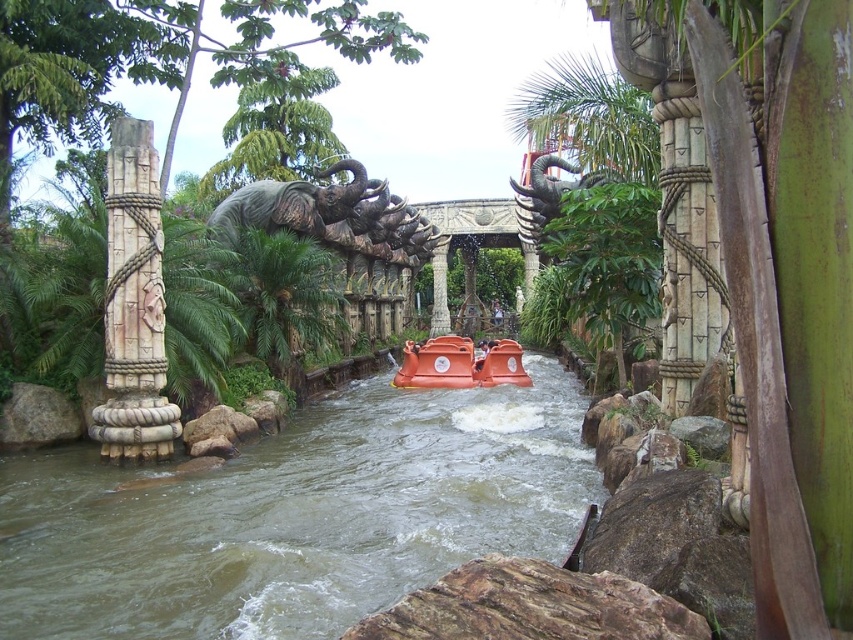
You are navigating a brown rubber boat at center on a waterway flanked by rocky banks and decorative columns. The boat must pass through a narrow passage. Given that the boat is at coordinates point 0.808, 0.348, can you determine if it is positioned correctly to navigate through the passage?

The brown rubber boat at center is positioned at point (296, 516), which is the correct coordinates to navigate through the narrow passage between the rocky banks and decorative columns.

You are a visitor standing at the entrance of the amusement park ride and see the carved stone column at left and the stone statue at center. Which object is closer to you?

The carved stone column at left is closer to you because it is in front of the stone statue at center.

You are a guest at the amusement park and want to take a photo of the brown rubber boat at center and the stone statue at center together in the frame. Which object should you position closer to the camera to ensure both are fully visible in the photo?

To ensure both the brown rubber boat at center and the stone statue at center are fully visible in the photo, you should position the brown rubber boat at center closer to the camera since it is shorter than the stone statue at center. This way, the statue won